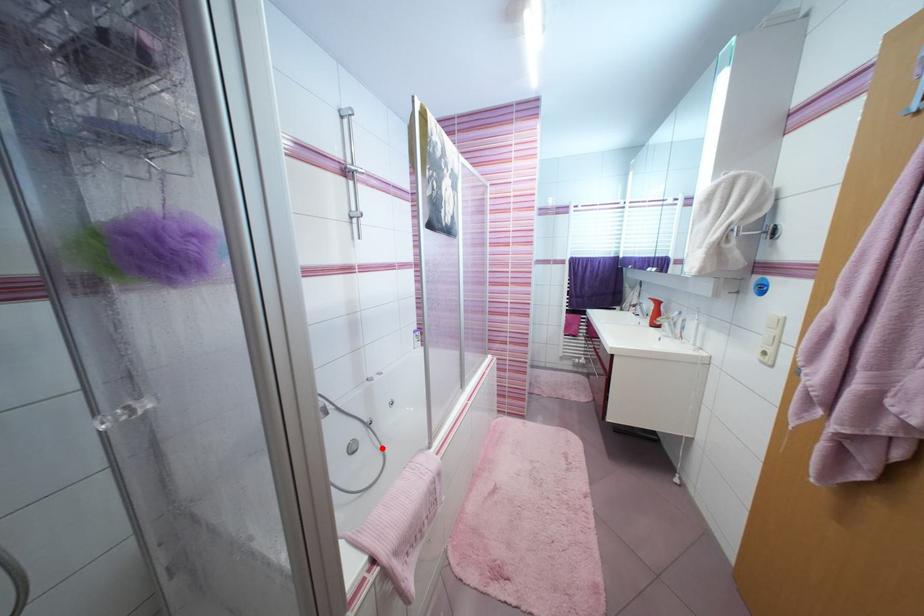
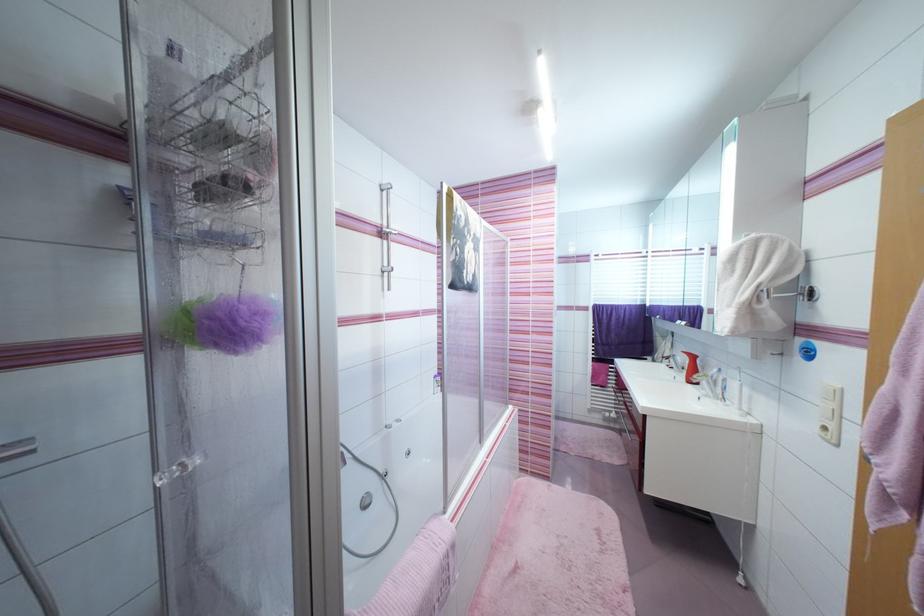
The point at the highlighted location is marked in the first image. Where is the corresponding point in the second image?

(395, 504)